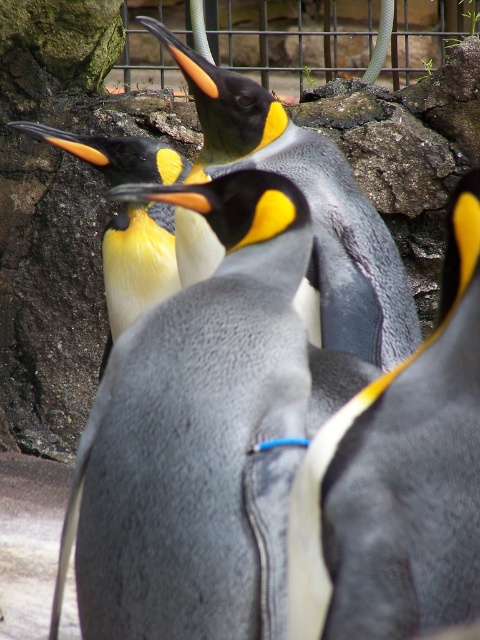
Question: Does smooth gray penguin at center appear under black glossy penguin at center?

Choices:
 (A) no
 (B) yes

Answer: (B)

Question: Which point is farther to the camera?

Choices:
 (A) gray matte penguin at center
 (B) matte black penguin at center
 (C) smooth gray penguin at center
 (D) black glossy penguin at center

Answer: (D)

Question: Does smooth gray penguin at center have a larger size compared to matte black penguin at center?

Choices:
 (A) no
 (B) yes

Answer: (A)

Question: Is gray matte penguin at center behind black glossy penguin at center?

Choices:
 (A) yes
 (B) no

Answer: (B)

Question: Estimate the real-world distances between objects in this image. Which object is closer to the matte black penguin at center?

Choices:
 (A) black glossy penguin at center
 (B) gray matte penguin at center
 (C) smooth gray penguin at center

Answer: (A)

Question: Based on their relative distances, which object is nearer to the gray matte penguin at center?

Choices:
 (A) smooth gray penguin at center
 (B) black glossy penguin at center

Answer: (A)